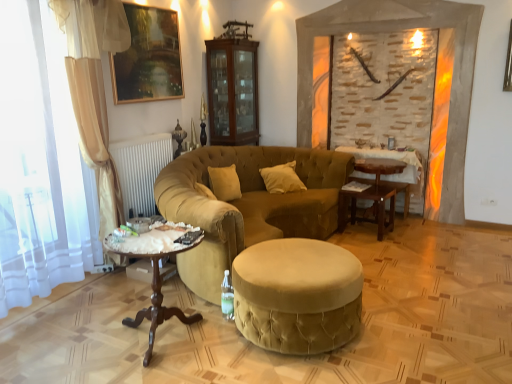
You are a GUI agent. You are given a task and a screenshot of the screen. Output one action in this format:
    pyautogui.click(x=<x>, y=<y>)
    Task: Click on the vacant space in between wooden polished table at lower left and white sheer curtain at left
    
    Given the screenshot: What is the action you would take?
    pyautogui.click(x=93, y=318)